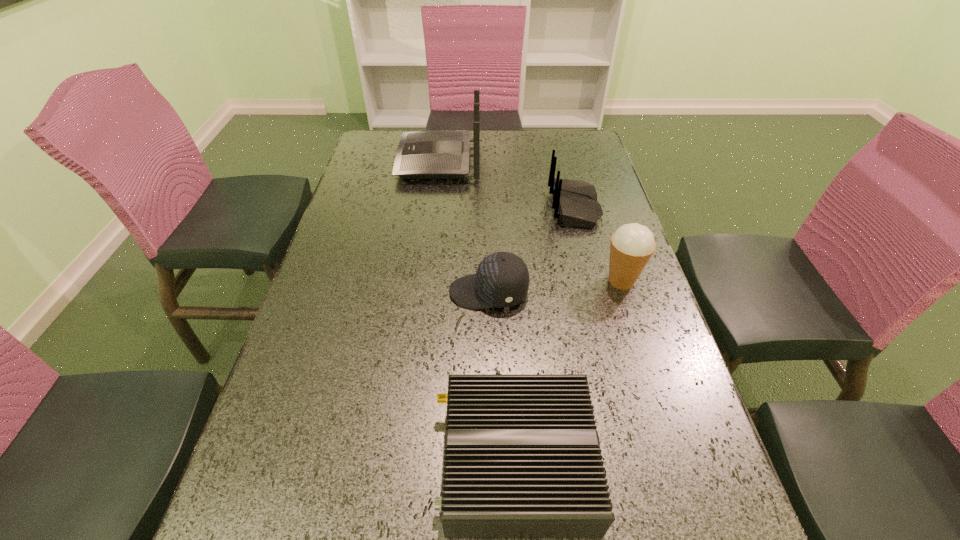
At what (x,y) coordinates should I click in order to perform the action: click on object at the far edge. Please return your answer as a coordinate pair (x, y). Image resolution: width=960 pixels, height=540 pixels. Looking at the image, I should click on (435, 154).

Locate an element on the screen. This screenshot has width=960, height=540. object at the left edge is located at coordinates (435, 154).

You are a GUI agent. You are given a task and a screenshot of the screen. Output one action in this format:
    pyautogui.click(x=<x>, y=<y>)
    Task: Click on the icecream situated at the right edge
    The image size is (960, 540).
    Given the screenshot: What is the action you would take?
    pyautogui.click(x=632, y=245)

Where is `router that is at the right edge`? This screenshot has height=540, width=960. router that is at the right edge is located at coordinates (575, 202).

Where is `object at the far left corner`? object at the far left corner is located at coordinates (435, 154).

Identify the location of free region at the far edge of the desktop. The image size is (960, 540). (538, 146).

The width and height of the screenshot is (960, 540). In the image, there is a desktop. What are the coordinates of `free space at the left edge` in the screenshot? It's located at (261, 502).

In the image, there is a desktop. At what (x,y) coordinates should I click in order to perform the action: click on vacant space at the right edge. Please return your answer as a coordinate pair (x, y). This screenshot has width=960, height=540. Looking at the image, I should click on (705, 449).

At what (x,y) coordinates should I click in order to perform the action: click on vacant space at the far left corner of the desktop. Please return your answer as a coordinate pair (x, y). The image size is (960, 540). Looking at the image, I should click on (367, 138).

Where is `free space at the far right corner`? This screenshot has height=540, width=960. free space at the far right corner is located at coordinates (561, 130).